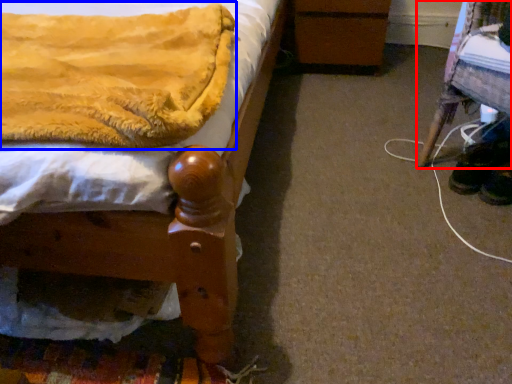
Question: Which object appears farthest to the camera in this image, furniture (highlighted by a red box) or blanket (highlighted by a blue box)?

Choices:
 (A) furniture
 (B) blanket

Answer: (A)